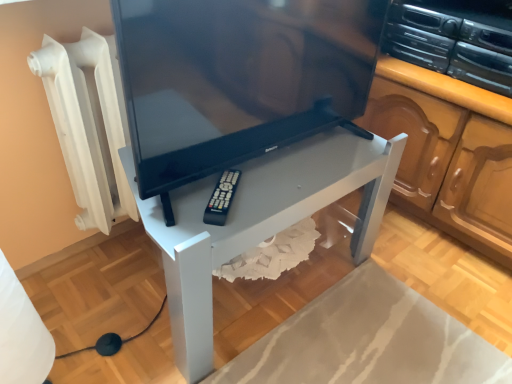
Question: Which is correct: white glossy table at center is inside black glossy tv at center, or outside of it?

Choices:
 (A) inside
 (B) outside

Answer: (B)

Question: Based on their positions, is white glossy table at center located to the left or right of black glossy tv at center?

Choices:
 (A) left
 (B) right

Answer: (A)

Question: Estimate the real-world distances between objects in this image. Which object is farther from the black glossy tv at center?

Choices:
 (A) black plastic stereo at upper right
 (B) white glossy table at center
 (C) black plastic remote at lower center

Answer: (A)

Question: Which object is the farthest from the black glossy tv at center?

Choices:
 (A) black plastic stereo at upper right
 (B) white glossy table at center
 (C) black plastic remote at lower center

Answer: (A)